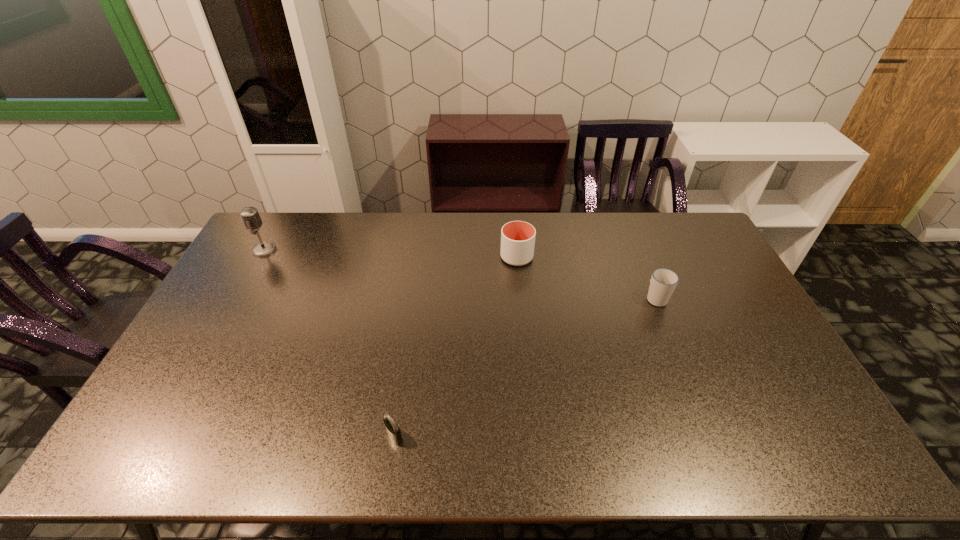
In order to click on vacant space that's between the tallest object and the nearest object in this screenshot , I will do `click(329, 343)`.

Where is `free area in between the nearest object and the second object from right to left`? The image size is (960, 540). free area in between the nearest object and the second object from right to left is located at coordinates (456, 347).

Locate an element on the screen. The image size is (960, 540). vacant space in between the third object from right to left and the right cup is located at coordinates (525, 367).

The width and height of the screenshot is (960, 540). I want to click on free space between the nearest object and the right cup, so click(525, 367).

The height and width of the screenshot is (540, 960). I want to click on vacant space in between the farther cup and the third farthest object, so 587,278.

Identify the location of the closest object to the nearer cup. (517, 237).

Locate an element on the screen. This screenshot has height=540, width=960. the second closest object relative to the padlock is located at coordinates (663, 282).